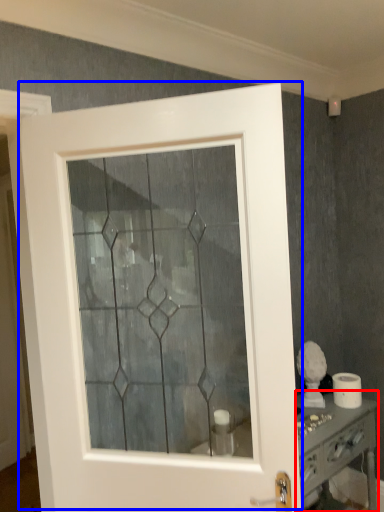
Question: Among these objects, which one is farthest to the camera, vanity (highlighted by a red box) or door (highlighted by a blue box)?

Choices:
 (A) vanity
 (B) door

Answer: (A)